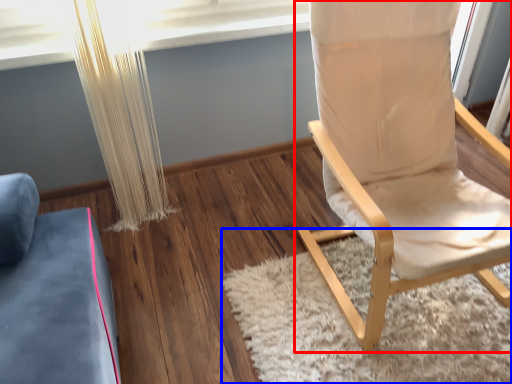
Question: Which of the following is the farthest to the observer, chair (highlighted by a red box) or mat (highlighted by a blue box)?

Choices:
 (A) chair
 (B) mat

Answer: (B)